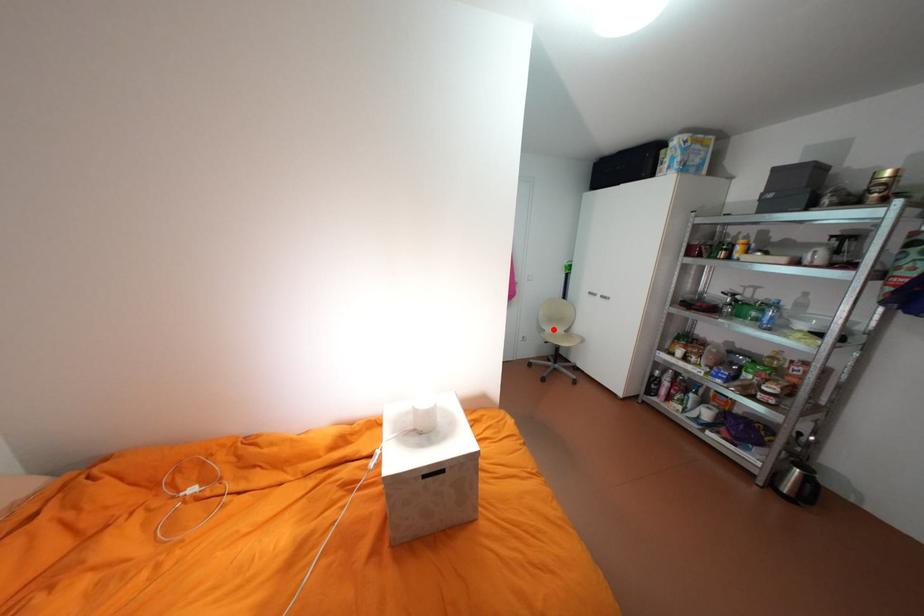
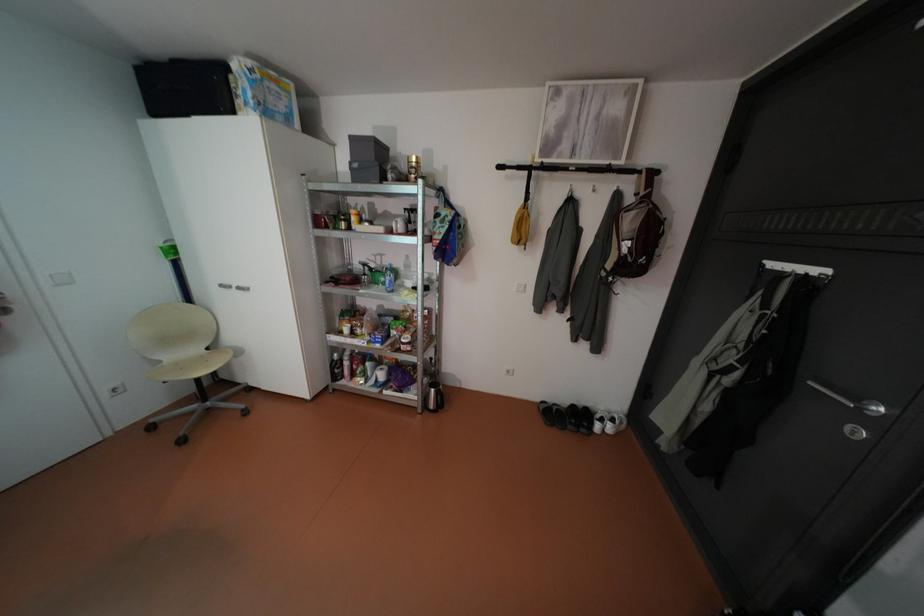
Where in the second image is the point corresponding to the highlighted location from the first image?

(168, 361)